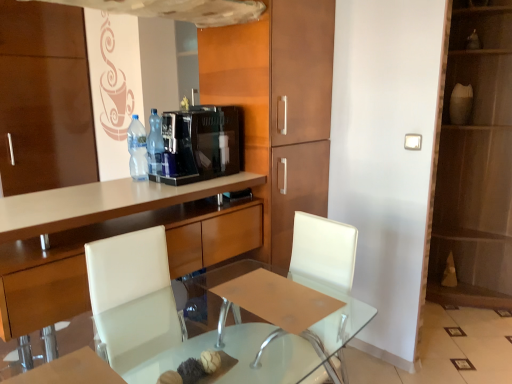
Question: Considering the relative sizes of clear glass table at center and black glossy coffee machine at center in the image provided, is clear glass table at center bigger than black glossy coffee machine at center?

Choices:
 (A) no
 (B) yes

Answer: (B)

Question: Is clear glass table at center not inside black glossy coffee machine at center?

Choices:
 (A) yes
 (B) no

Answer: (A)

Question: Is clear glass table at center behind black glossy coffee machine at center?

Choices:
 (A) no
 (B) yes

Answer: (A)

Question: Does clear glass table at center have a smaller size compared to black glossy coffee machine at center?

Choices:
 (A) no
 (B) yes

Answer: (A)

Question: Is clear glass table at center placed right next to black glossy coffee machine at center?

Choices:
 (A) yes
 (B) no

Answer: (B)

Question: Is point (160, 165) closer or farther from the camera than point (134, 134)?

Choices:
 (A) farther
 (B) closer

Answer: (B)

Question: In the image, is translucent plastic bottle at center, which is the first bottle from right to left, on the left side or the right side of clear plastic bottle at center, which is the second bottle from right to left?

Choices:
 (A) right
 (B) left

Answer: (A)

Question: Would you say translucent plastic bottle at center, which is the first bottle from right to left, is inside or outside clear plastic bottle at center, the 1th bottle in the left-to-right sequence?

Choices:
 (A) outside
 (B) inside

Answer: (A)

Question: Is translucent plastic bottle at center, which is the first bottle from right to left, in front of or behind clear plastic bottle at center, which is the second bottle from right to left, in the image?

Choices:
 (A) front
 (B) behind

Answer: (B)

Question: Considering the positions of wooden cabinet at center, marked as the 1th cabinetry in a left-to-right arrangement, and clear glass table at center in the image, is wooden cabinet at center, marked as the 1th cabinetry in a left-to-right arrangement, taller or shorter than clear glass table at center?

Choices:
 (A) tall
 (B) short

Answer: (A)

Question: From the image's perspective, is wooden cabinet at center, marked as the 1th cabinetry in a left-to-right arrangement, above or below clear glass table at center?

Choices:
 (A) below
 (B) above

Answer: (B)

Question: Is wooden cabinet at center, marked as the 1th cabinetry in a left-to-right arrangement, to the left or to the right of clear glass table at center in the image?

Choices:
 (A) right
 (B) left

Answer: (B)

Question: Considering the positions of wooden cabinet at center, marked as the 1th cabinetry in a left-to-right arrangement, and clear glass table at center in the image, is wooden cabinet at center, marked as the 1th cabinetry in a left-to-right arrangement, wider or thinner than clear glass table at center?

Choices:
 (A) thin
 (B) wide

Answer: (B)

Question: Is wooden cabinet at center, which ranks as the 1th cabinetry in right-to-left order, spatially inside white leather armchair at center, or outside of it?

Choices:
 (A) inside
 (B) outside

Answer: (B)

Question: From the image's perspective, relative to white leather armchair at center, is wooden cabinet at center, which ranks as the 1th cabinetry in right-to-left order, above or below?

Choices:
 (A) above
 (B) below

Answer: (A)